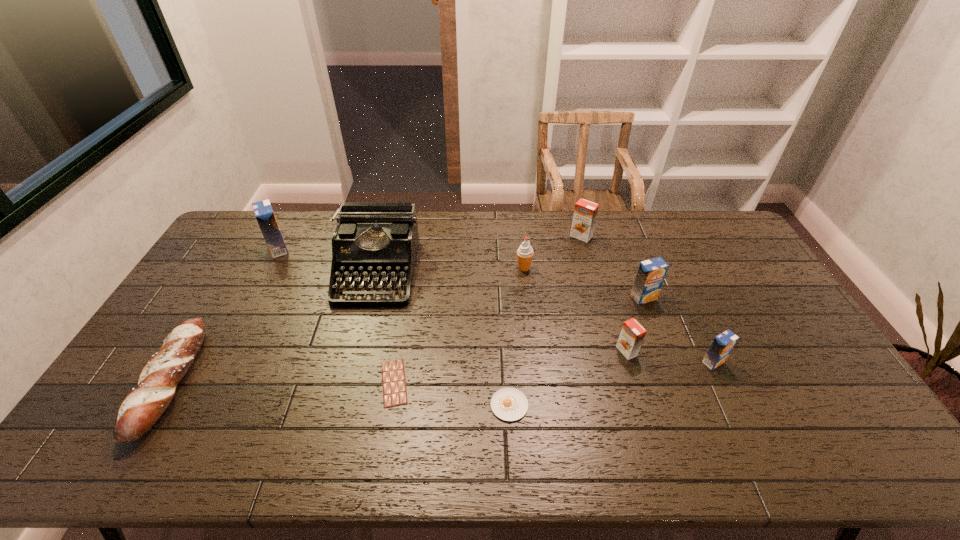
This screenshot has width=960, height=540. In the image, there is a desktop. Identify the location of free space at the right edge. (708, 261).

At what (x,y) coordinates should I click in order to perform the action: click on free space at the far left corner of the desktop. Please return your answer as a coordinate pair (x, y). Looking at the image, I should click on (258, 228).

Locate an element on the screen. vacant space at the near left corner of the desktop is located at coordinates (146, 437).

This screenshot has height=540, width=960. In order to click on vacant area that lies between the chocolate bar and the icecream in this screenshot , I will do `click(459, 325)`.

The width and height of the screenshot is (960, 540). I want to click on unoccupied position between the second nearest blue orange_juice and the typewriter, so click(x=510, y=285).

Locate an element on the screen. The width and height of the screenshot is (960, 540). empty space between the ninth tallest object and the red icecream is located at coordinates (516, 336).

You are a GUI agent. You are given a task and a screenshot of the screen. Output one action in this format:
    pyautogui.click(x=<x>, y=<y>)
    Task: Click on the empty space between the chocolate bar and the nearer orange orange juice
    Image resolution: width=960 pixels, height=540 pixels.
    Given the screenshot: What is the action you would take?
    pyautogui.click(x=511, y=367)

I want to click on free spot between the red icecream and the baguet, so click(x=348, y=325).

At what (x,y) coordinates should I click in order to perform the action: click on empty space that is in between the nearer orange orange juice and the black typewriter. Please return your answer as a coordinate pair (x, y). Looking at the image, I should click on (501, 312).

This screenshot has height=540, width=960. I want to click on free space between the shortest object and the black typewriter, so click(385, 327).